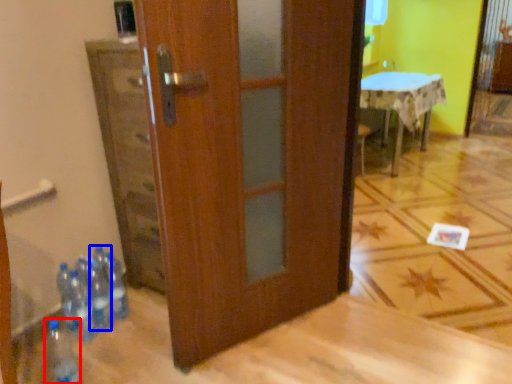
Question: Which of the following is the farthest to the observer, bottle (highlighted by a red box) or bottle (highlighted by a blue box)?

Choices:
 (A) bottle
 (B) bottle

Answer: (B)